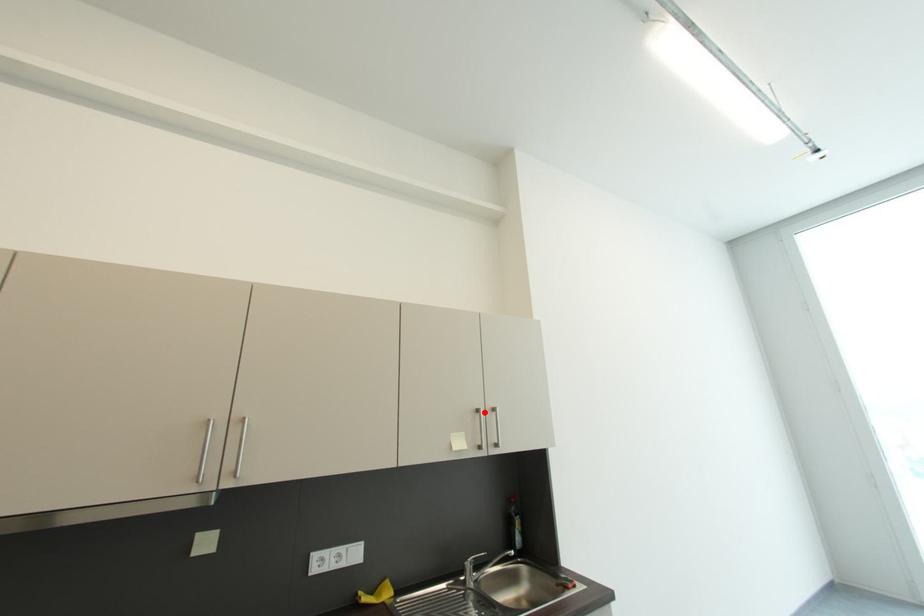
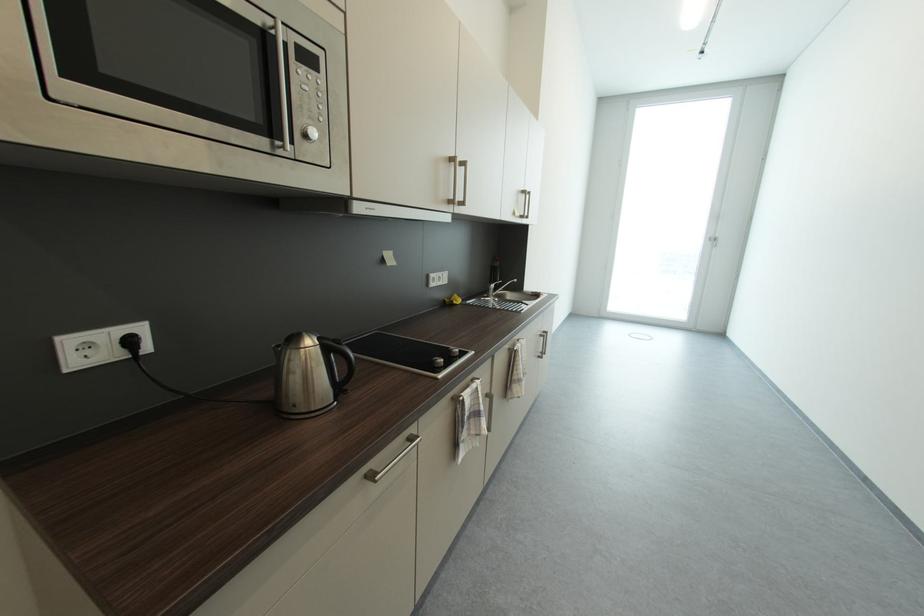
Where in the second image is the point corresponding to the highlighted location from the first image?

(529, 193)